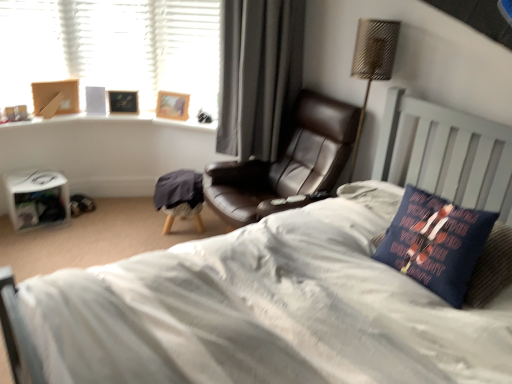
Find the location of a particular element. This screenshot has height=384, width=512. free space between wooden picture frame at upper left, the 1th picture frame when ordered from left to right, and wooden picture frame at upper left, marked as the first picture frame in a right-to-left arrangement is located at coordinates (147, 115).